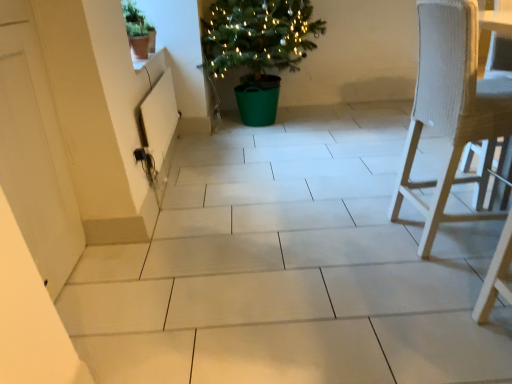
Question: Is white woven chair at right at the right side of green plastic potted plant at center, acting as the 2th houseplant starting from the front?

Choices:
 (A) no
 (B) yes

Answer: (B)

Question: Considering the relative sizes of white woven chair at right and green plastic potted plant at center, which is the first houseplant from right to left, in the image provided, is white woven chair at right wider than green plastic potted plant at center, which is the first houseplant from right to left,?

Choices:
 (A) yes
 (B) no

Answer: (B)

Question: Is white woven chair at right positioned with its back to green plastic potted plant at center, which ranks as the 2th houseplant in left-to-right order?

Choices:
 (A) no
 (B) yes

Answer: (A)

Question: From the image's perspective, is white woven chair at right on top of green plastic potted plant at center, acting as the 2th houseplant starting from the front?

Choices:
 (A) yes
 (B) no

Answer: (B)

Question: Is green plastic potted plant at center, which is the 1th houseplant from back to front, completely or partially inside white woven chair at right?

Choices:
 (A) yes
 (B) no

Answer: (B)

Question: Considering the relative positions of white woven chair at right and green plastic potted plant at center, which is the first houseplant from right to left, in the image provided, is white woven chair at right to the left of green plastic potted plant at center, which is the first houseplant from right to left, from the viewer's perspective?

Choices:
 (A) no
 (B) yes

Answer: (A)

Question: Is green matte pot at upper left, which ranks as the 1th houseplant in left-to-right order, at the right side of white woven chair at right?

Choices:
 (A) no
 (B) yes

Answer: (A)

Question: Would you say white woven chair at right is part of green matte pot at upper left, arranged as the second houseplant when viewed from the right,'s contents?

Choices:
 (A) no
 (B) yes

Answer: (A)

Question: Is green matte pot at upper left, which is the first houseplant in front-to-back order, oriented away from white woven chair at right?

Choices:
 (A) no
 (B) yes

Answer: (A)

Question: From a real-world perspective, is green matte pot at upper left, which is the first houseplant in front-to-back order, physically below white woven chair at right?

Choices:
 (A) yes
 (B) no

Answer: (B)

Question: Is green matte pot at upper left, which ranks as the 1th houseplant in left-to-right order, directly adjacent to white woven chair at right?

Choices:
 (A) no
 (B) yes

Answer: (A)

Question: Does green matte pot at upper left, which ranks as the 1th houseplant in left-to-right order, have a greater height compared to white woven chair at right?

Choices:
 (A) yes
 (B) no

Answer: (B)

Question: Considering the relative sizes of white matte door at left and green plastic potted plant at center, which is the 1th houseplant from back to front, in the image provided, is white matte door at left bigger than green plastic potted plant at center, which is the 1th houseplant from back to front,?

Choices:
 (A) no
 (B) yes

Answer: (A)